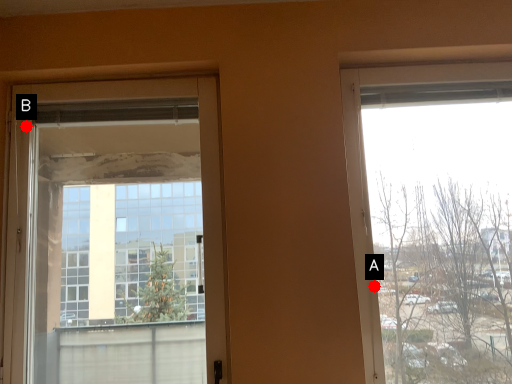
Question: Two points are circled on the image, labeled by A and B beside each circle. Which point is closer to the camera?

Choices:
 (A) A is closer
 (B) B is closer

Answer: (A)